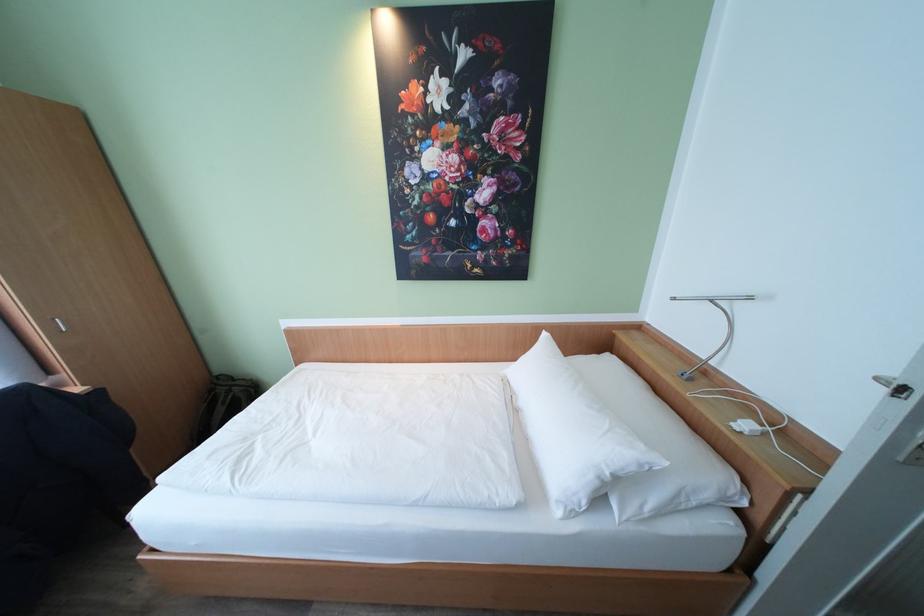
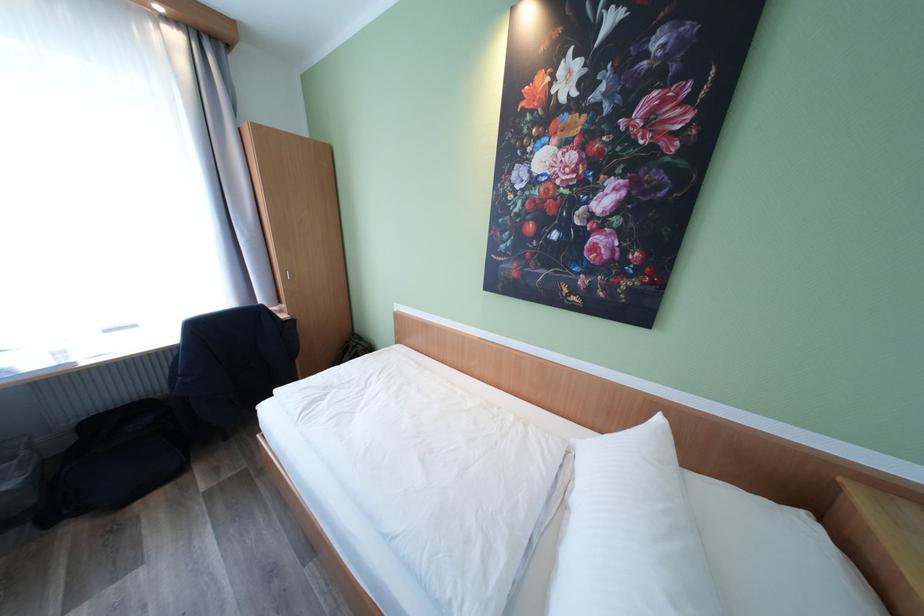
Question: The images are taken continuously from a first-person perspective. In which direction is your viewpoint rotating?

Choices:
 (A) Left
 (B) Right
 (C) Up
 (D) Down

Answer: (A)